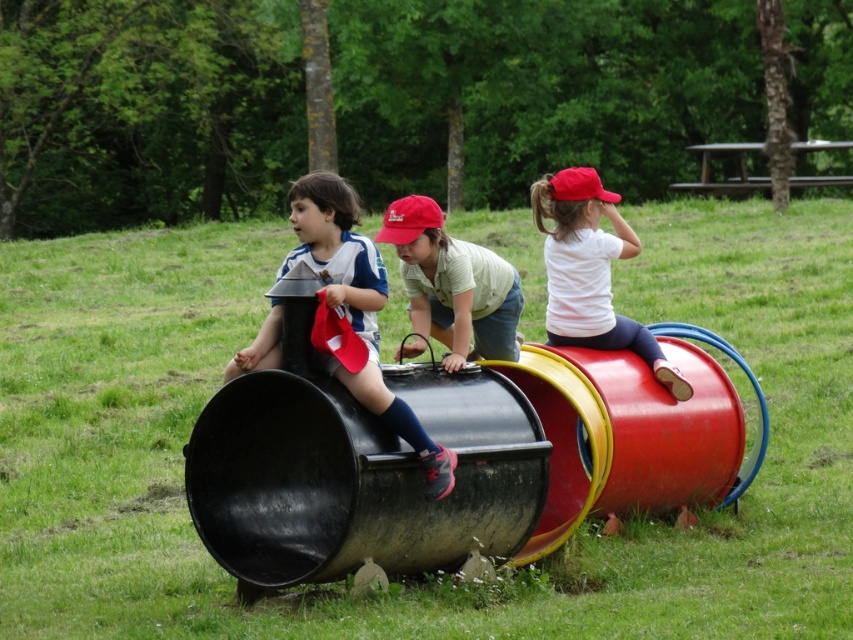
Question: Which point is closer to the camera?

Choices:
 (A) (505, 298)
 (B) (357, 397)

Answer: (B)

Question: Is matte black pants at left bigger than white matte shirt at upper right?

Choices:
 (A) yes
 (B) no

Answer: (B)

Question: Which point is farther to the camera?

Choices:
 (A) matte red cap at center
 (B) white matte shirt at upper right
 (C) matte black pants at left

Answer: (B)

Question: Can you confirm if matte black pants at left is positioned above matte red cap at center?

Choices:
 (A) no
 (B) yes

Answer: (A)

Question: Among these points, which one is nearest to the camera?

Choices:
 (A) click(595, 305)
 (B) click(463, 324)
 (C) click(264, 364)

Answer: (C)

Question: Can you confirm if white matte shirt at upper right is smaller than matte red cap at center?

Choices:
 (A) yes
 (B) no

Answer: (B)